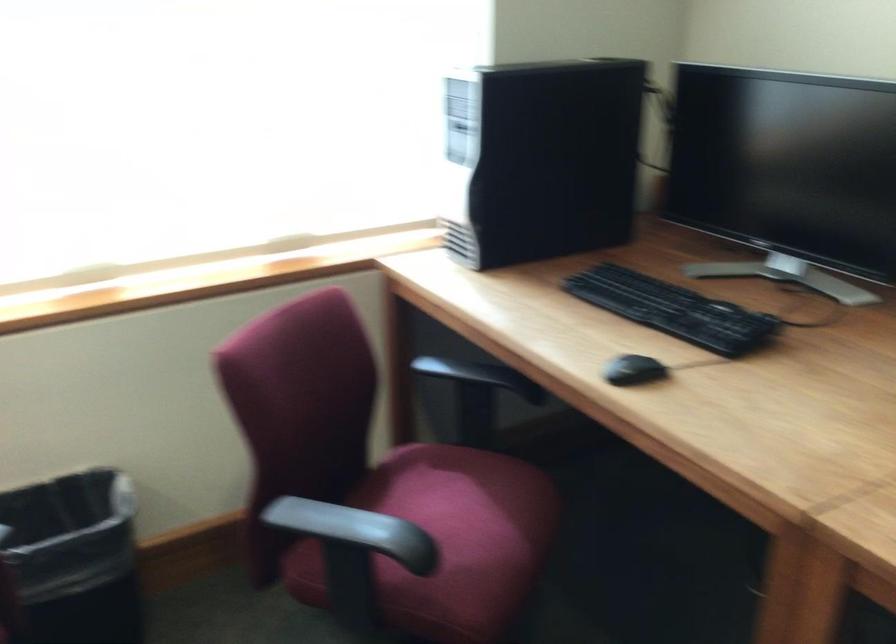
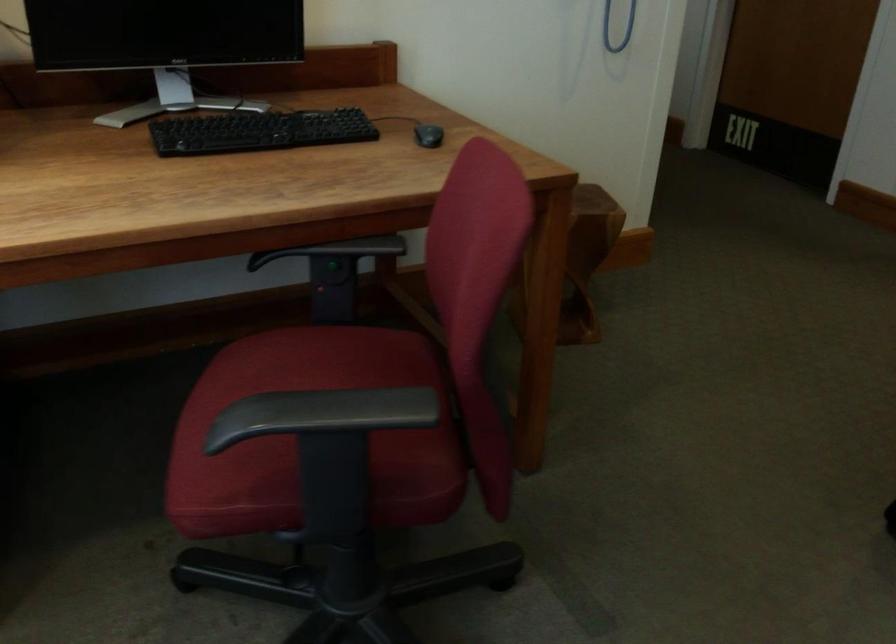
How did the camera likely rotate?

The camera's rotation is toward right-down.